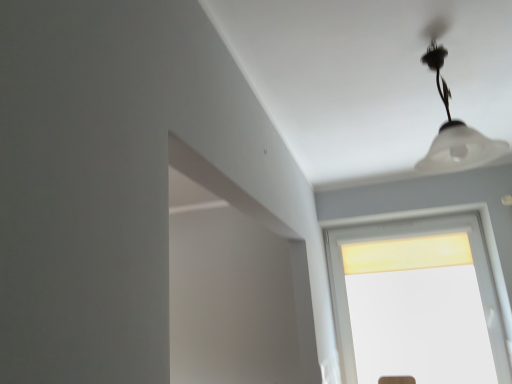
Question: Is white frosted lampshade at upper center further to camera compared to matte yellow glass window at center?

Choices:
 (A) no
 (B) yes

Answer: (A)

Question: From the image's perspective, is white frosted lampshade at upper center located beneath matte yellow glass window at center?

Choices:
 (A) no
 (B) yes

Answer: (A)

Question: From the image's perspective, does white frosted lampshade at upper center appear higher than matte yellow glass window at center?

Choices:
 (A) yes
 (B) no

Answer: (A)

Question: Does white frosted lampshade at upper center have a greater height compared to matte yellow glass window at center?

Choices:
 (A) no
 (B) yes

Answer: (A)

Question: Considering the relative positions of white frosted lampshade at upper center and matte yellow glass window at center in the image provided, is white frosted lampshade at upper center in front of matte yellow glass window at center?

Choices:
 (A) no
 (B) yes

Answer: (B)

Question: Is white frosted lampshade at upper center thinner than matte yellow glass window at center?

Choices:
 (A) no
 (B) yes

Answer: (A)

Question: Would you say white frosted lampshade at upper center is part of matte yellow glass window at center's contents?

Choices:
 (A) no
 (B) yes

Answer: (A)

Question: From a real-world perspective, is matte yellow glass window at center positioned under white frosted lampshade at upper center based on gravity?

Choices:
 (A) no
 (B) yes

Answer: (B)

Question: Is matte yellow glass window at center looking in the opposite direction of white frosted lampshade at upper center?

Choices:
 (A) no
 (B) yes

Answer: (A)

Question: Does matte yellow glass window at center appear on the left side of white frosted lampshade at upper center?

Choices:
 (A) yes
 (B) no

Answer: (B)

Question: Is matte yellow glass window at center wider than white frosted lampshade at upper center?

Choices:
 (A) no
 (B) yes

Answer: (A)

Question: From the image's perspective, does matte yellow glass window at center appear lower than white frosted lampshade at upper center?

Choices:
 (A) no
 (B) yes

Answer: (B)

Question: Is white frosted lampshade at upper center inside the boundaries of matte yellow glass window at center, or outside?

Choices:
 (A) inside
 (B) outside

Answer: (B)